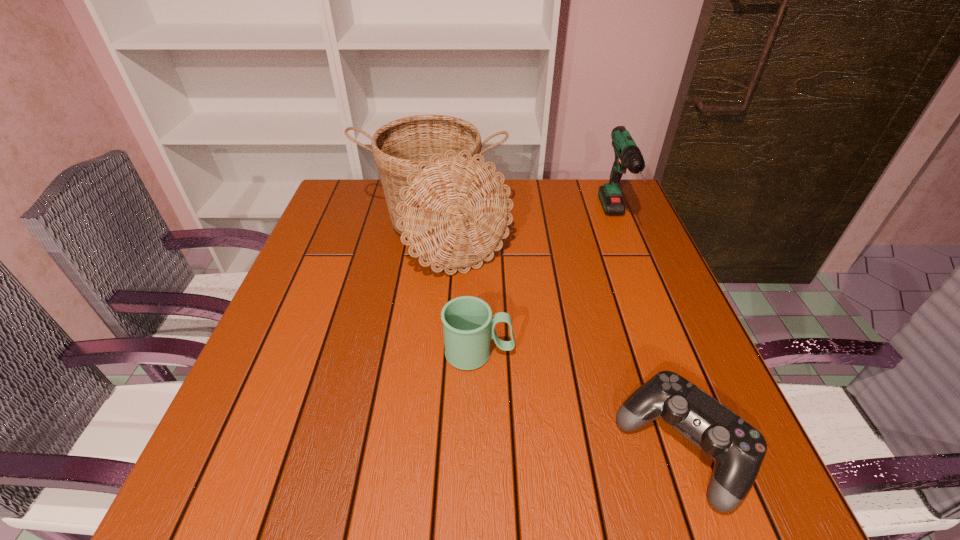
You are a GUI agent. You are given a task and a screenshot of the screen. Output one action in this format:
    pyautogui.click(x=<x>, y=<y>)
    Task: Click on the basket located in the far edge section of the desktop
    
    Given the screenshot: What is the action you would take?
    pyautogui.click(x=452, y=208)

The height and width of the screenshot is (540, 960). I want to click on drill located at the far edge, so click(x=628, y=156).

You are a GUI agent. You are given a task and a screenshot of the screen. Output one action in this format:
    pyautogui.click(x=<x>, y=<y>)
    Task: Click on the object that is at the near edge
    
    Given the screenshot: What is the action you would take?
    pyautogui.click(x=738, y=449)

Find the location of a particular element. The height and width of the screenshot is (540, 960). object at the left edge is located at coordinates (452, 208).

In order to click on drill that is at the right edge in this screenshot , I will do `click(628, 156)`.

Where is `control that is at the right edge`? The height and width of the screenshot is (540, 960). control that is at the right edge is located at coordinates (738, 449).

I want to click on object at the far left corner, so click(452, 208).

Identify the location of object positioned at the far right corner. This screenshot has height=540, width=960. (628, 156).

I want to click on object that is at the near right corner, so click(x=738, y=449).

In order to click on free space at the far edge of the desktop in this screenshot , I will do `click(539, 201)`.